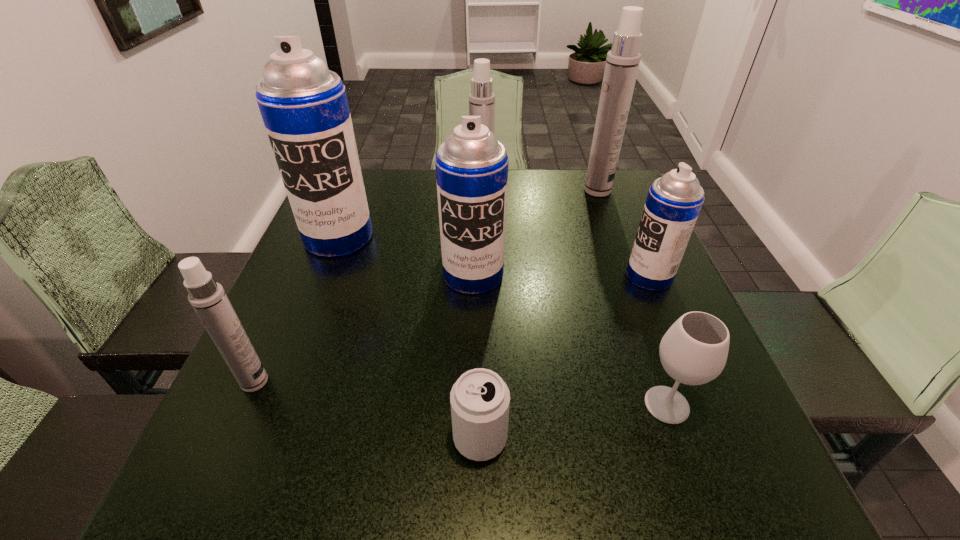
Identify the location of the rightmost white aerosol can. (622, 62).

Identify the location of the leftmost blue aerosol can. This screenshot has height=540, width=960. (304, 106).

I want to click on the second white aerosol can from right to left, so click(x=481, y=99).

In order to click on the second biggest blue aerosol can in this screenshot , I will do `click(471, 166)`.

The height and width of the screenshot is (540, 960). Find the location of `the rightmost blue aerosol can`. the rightmost blue aerosol can is located at coordinates (674, 201).

The height and width of the screenshot is (540, 960). Find the location of `the leftmost white aerosol can`. the leftmost white aerosol can is located at coordinates (207, 297).

Where is `the smallest white aerosol can`? This screenshot has height=540, width=960. the smallest white aerosol can is located at coordinates click(207, 297).

At what (x,y) coordinates should I click in order to perform the action: click on the seventh tallest object. Please return your answer as a coordinate pair (x, y). Looking at the image, I should click on (694, 350).

Where is `the shortest object`? This screenshot has width=960, height=540. the shortest object is located at coordinates (480, 400).

Identify the location of blank space located on the front of the biggest white aerosol can. The width and height of the screenshot is (960, 540). (625, 264).